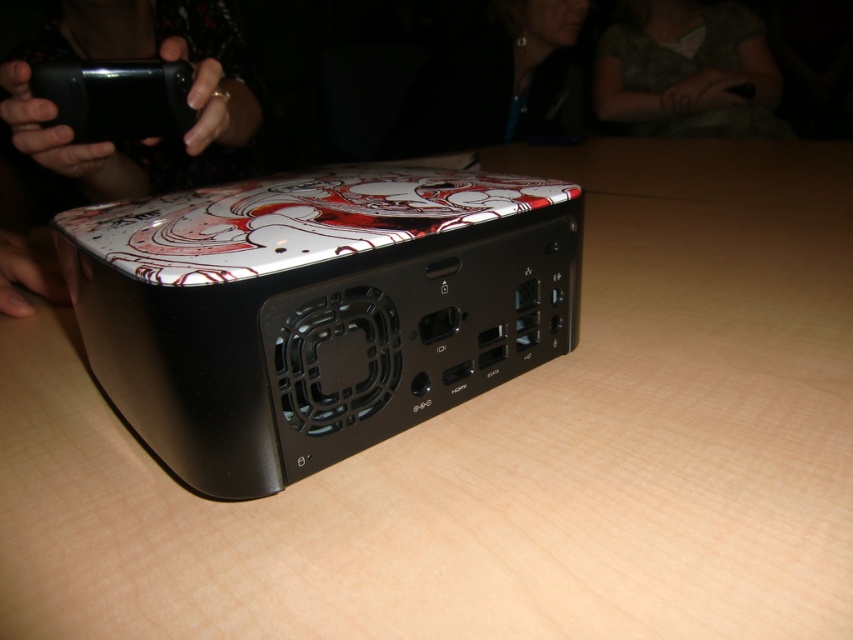
Is point (13, 275) more distant than point (138, 83)?

Yes, point (13, 275) is behind point (138, 83).

This screenshot has width=853, height=640. I want to click on matte black phone at upper left, so (x=140, y=58).

I want to click on matte black phone at upper left, so click(x=140, y=58).

In the scene shown: Does matte black phone at upper left appear over green textured shirt at upper center?

Actually, matte black phone at upper left is below green textured shirt at upper center.

Between matte black phone at upper left and green textured shirt at upper center, which one appears on the left side from the viewer's perspective?

Positioned to the left is matte black phone at upper left.

What do you see at coordinates (140, 58) in the screenshot? This screenshot has height=640, width=853. I see `matte black phone at upper left` at bounding box center [140, 58].

In order to click on matte black phone at upper left in this screenshot , I will do `click(140, 58)`.

Which is more to the left, green textured shirt at upper center or black glossy phone at upper left?

black glossy phone at upper left

Can you confirm if green textured shirt at upper center is bigger than black glossy phone at upper left?

Indeed, green textured shirt at upper center has a larger size compared to black glossy phone at upper left.

Is point (744, 35) behind point (109, 115)?

That is True.

At what (x,y) coordinates should I click in order to perform the action: click on green textured shirt at upper center. Please return your answer as a coordinate pair (x, y). This screenshot has width=853, height=640. Looking at the image, I should click on (688, 72).